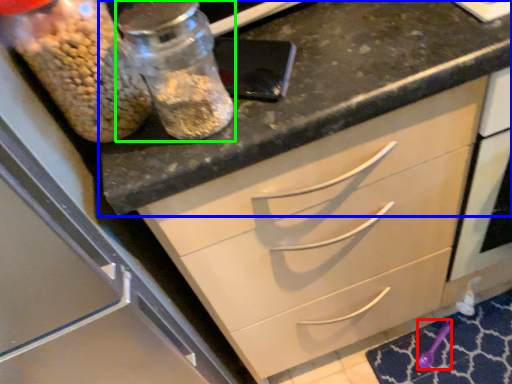
Question: Based on their relative distances, which object is farther from utensil (highlighted by a red box)? Choose from countertop (highlighted by a blue box) and glass jar (highlighted by a green box).

Choices:
 (A) countertop
 (B) glass jar

Answer: (B)